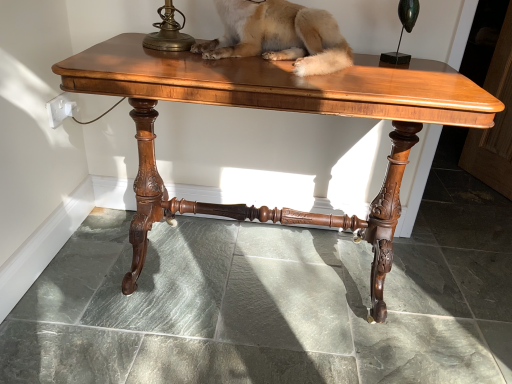
Question: Is fuzzy beige dog at center oriented towards green polished glass candle holder at upper right?

Choices:
 (A) yes
 (B) no

Answer: (B)

Question: From the image's perspective, does fuzzy beige dog at center appear lower than green polished glass candle holder at upper right?

Choices:
 (A) yes
 (B) no

Answer: (A)

Question: Is fuzzy beige dog at center facing away from green polished glass candle holder at upper right?

Choices:
 (A) yes
 (B) no

Answer: (B)

Question: Considering the relative sizes of fuzzy beige dog at center and green polished glass candle holder at upper right in the image provided, is fuzzy beige dog at center wider than green polished glass candle holder at upper right?

Choices:
 (A) no
 (B) yes

Answer: (B)

Question: Considering the relative positions of fuzzy beige dog at center and green polished glass candle holder at upper right in the image provided, is fuzzy beige dog at center behind green polished glass candle holder at upper right?

Choices:
 (A) no
 (B) yes

Answer: (A)

Question: Can we say fuzzy beige dog at center lies outside green polished glass candle holder at upper right?

Choices:
 (A) yes
 (B) no

Answer: (A)

Question: Is the position of green polished glass candle holder at upper right less distant than that of shiny brown wood table at center?

Choices:
 (A) no
 (B) yes

Answer: (A)

Question: Would you say green polished glass candle holder at upper right is a long distance from shiny brown wood table at center?

Choices:
 (A) yes
 (B) no

Answer: (B)

Question: Is green polished glass candle holder at upper right wider than shiny brown wood table at center?

Choices:
 (A) no
 (B) yes

Answer: (A)

Question: Can you confirm if green polished glass candle holder at upper right is bigger than shiny brown wood table at center?

Choices:
 (A) yes
 (B) no

Answer: (B)

Question: Is green polished glass candle holder at upper right to the left of shiny brown wood table at center from the viewer's perspective?

Choices:
 (A) no
 (B) yes

Answer: (A)

Question: Is green polished glass candle holder at upper right facing towards shiny brown wood table at center?

Choices:
 (A) yes
 (B) no

Answer: (B)

Question: Does shiny brown wood table at center have a smaller size compared to fuzzy beige dog at center?

Choices:
 (A) yes
 (B) no

Answer: (B)